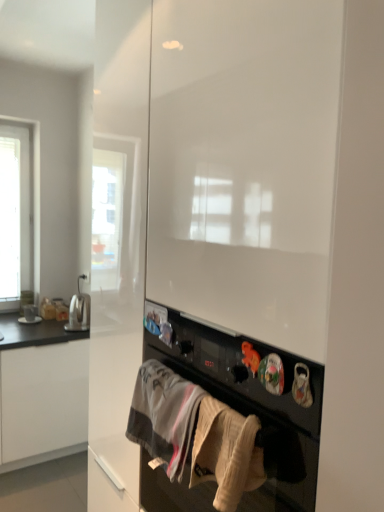
Question: Does white glossy cabinet at left have a lesser width compared to black matte oven at center?

Choices:
 (A) yes
 (B) no

Answer: (B)

Question: Is white glossy cabinet at left positioned beyond the bounds of black matte oven at center?

Choices:
 (A) yes
 (B) no

Answer: (A)

Question: Is white glossy cabinet at left looking in the opposite direction of black matte oven at center?

Choices:
 (A) yes
 (B) no

Answer: (B)

Question: Can you confirm if white glossy cabinet at left is wider than black matte oven at center?

Choices:
 (A) no
 (B) yes

Answer: (B)

Question: Is white glossy cabinet at left at the left side of black matte oven at center?

Choices:
 (A) yes
 (B) no

Answer: (A)

Question: Is white glossy cabinet at left to the right of black matte oven at center from the viewer's perspective?

Choices:
 (A) no
 (B) yes

Answer: (A)

Question: Considering the relative sizes of beige cotton towel at lower center, acting as the second clothing starting from the left, and black matte oven at center in the image provided, is beige cotton towel at lower center, acting as the second clothing starting from the left, taller than black matte oven at center?

Choices:
 (A) no
 (B) yes

Answer: (A)

Question: Does beige cotton towel at lower center, which appears as the first clothing when viewed from the front, have a lesser width compared to black matte oven at center?

Choices:
 (A) yes
 (B) no

Answer: (A)

Question: Can you confirm if beige cotton towel at lower center, acting as the second clothing starting from the left, is bigger than black matte oven at center?

Choices:
 (A) yes
 (B) no

Answer: (B)

Question: Does beige cotton towel at lower center, acting as the second clothing starting from the left, turn towards black matte oven at center?

Choices:
 (A) yes
 (B) no

Answer: (B)

Question: Is beige cotton towel at lower center, which is counted as the second clothing, starting from the back, not within black matte oven at center?

Choices:
 (A) no
 (B) yes

Answer: (A)

Question: From a real-world perspective, is beige cotton towel at lower center, acting as the second clothing starting from the left, located higher than black matte oven at center?

Choices:
 (A) no
 (B) yes

Answer: (B)

Question: Considering the relative sizes of white cotton towel at lower center, which appears as the 1th clothing when viewed from the left, and satin silver toaster at left in the image provided, is white cotton towel at lower center, which appears as the 1th clothing when viewed from the left, bigger than satin silver toaster at left?

Choices:
 (A) yes
 (B) no

Answer: (B)